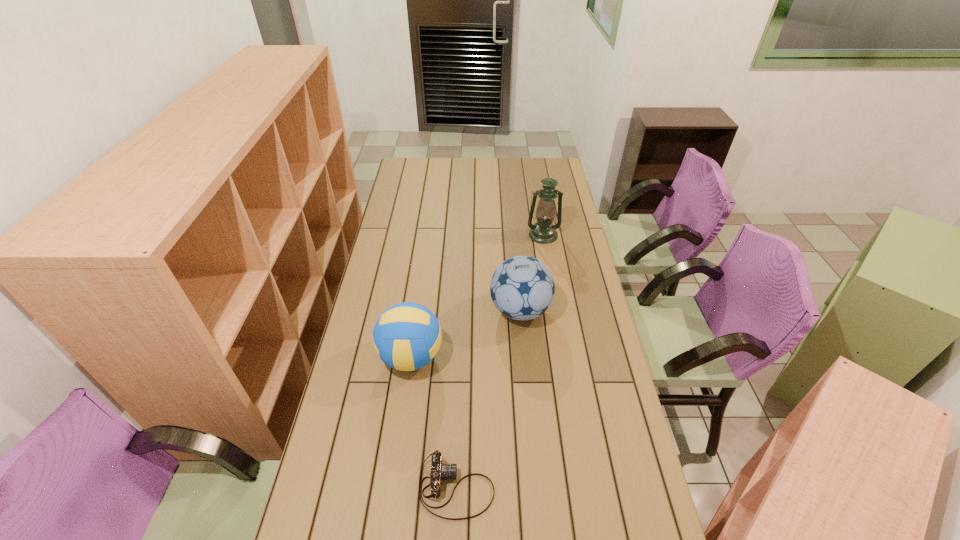
Where is `unoccupied area between the volleyball and the soccer ball`? unoccupied area between the volleyball and the soccer ball is located at coordinates click(466, 334).

In order to click on free point between the tallest object and the shortest object in this screenshot , I will do `click(500, 361)`.

Find the location of a particular element. The width and height of the screenshot is (960, 540). free space between the camera and the soccer ball is located at coordinates (489, 399).

The image size is (960, 540). In order to click on free spot between the tallest object and the camera in this screenshot , I will do `click(500, 361)`.

I want to click on vacant region between the farthest object and the nearest object, so click(x=500, y=361).

Identify the location of empty space that is in between the farthest object and the nearest object. (500, 361).

What are the coordinates of `blank region between the shortest object and the tallest object` in the screenshot? It's located at (500, 361).

This screenshot has width=960, height=540. In order to click on vacant area that lies between the soccer ball and the volleyball in this screenshot , I will do `click(466, 334)`.

Locate an element on the screen. vacant area that lies between the nearest object and the tallest object is located at coordinates (500, 361).

Identify which object is the second nearest to the soccer ball. Please provide its 2D coordinates. Your answer should be formatted as a tuple, i.e. [(x, y)], where the tuple contains the x and y coordinates of a point satisfying the conditions above.

[(543, 231)]